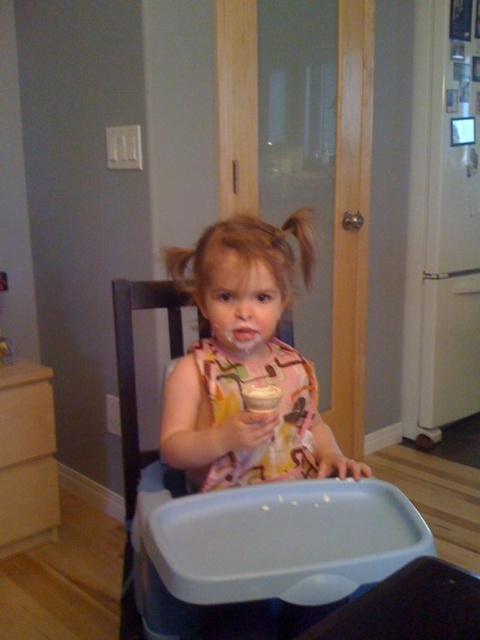
Can you confirm if matte pink dress at center is taller than printed fabric bib at center?

Yes, matte pink dress at center is taller than printed fabric bib at center.

How distant is matte pink dress at center from printed fabric bib at center?

matte pink dress at center is 1.80 inches from printed fabric bib at center.

Between point (249, 337) and point (262, 360), which one is positioned in front?

Point (249, 337) is in front.

Locate an element on the screen. The width and height of the screenshot is (480, 640). matte pink dress at center is located at coordinates tap(245, 362).

Is matte pink dress at center closer to camera compared to white matte cup at center?

That is False.

Can you confirm if matte pink dress at center is positioned above white matte cup at center?

Yes, matte pink dress at center is above white matte cup at center.

Is point (205, 387) more distant than point (262, 396)?

Yes, it is.

The height and width of the screenshot is (640, 480). In order to click on matte pink dress at center in this screenshot , I will do `click(245, 362)`.

How far apart are printed fabric bib at center and white matte cup at center?

printed fabric bib at center and white matte cup at center are 9.21 centimeters apart.

Is printed fabric bib at center in front of white matte cup at center?

No.

Find the location of a particular element. The height and width of the screenshot is (640, 480). printed fabric bib at center is located at coordinates (243, 406).